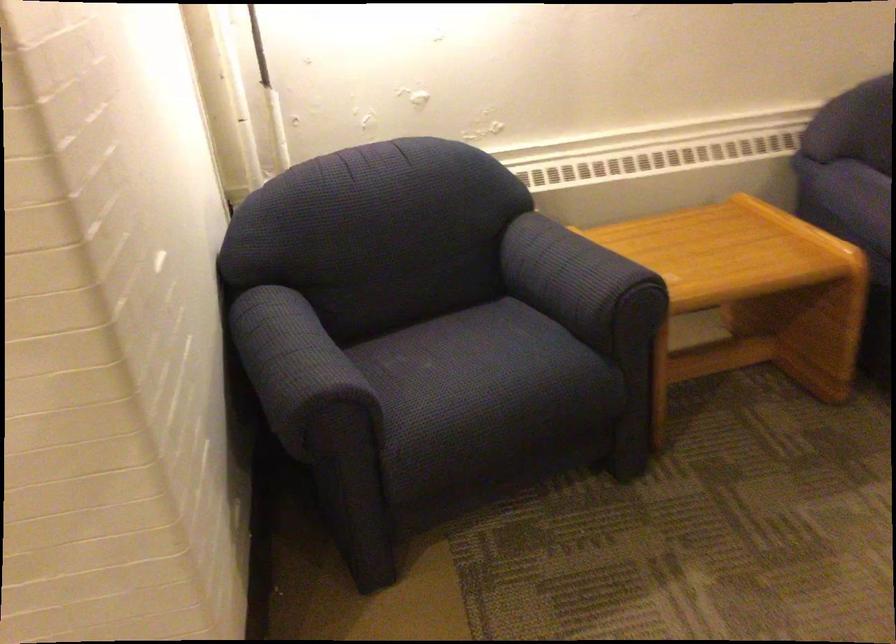
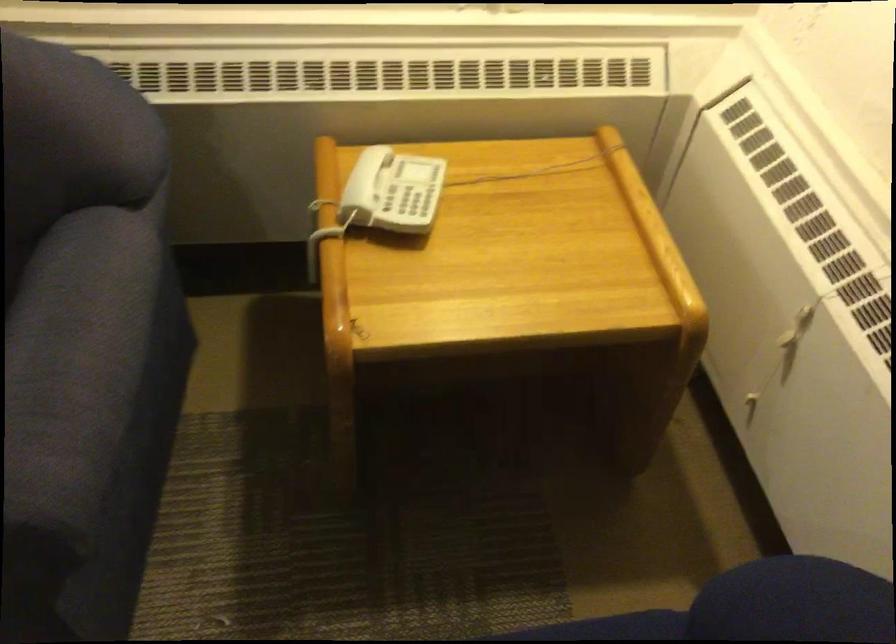
The images are taken continuously from a first-person perspective. In which direction are you moving?

The cameraman walked toward right, forward.